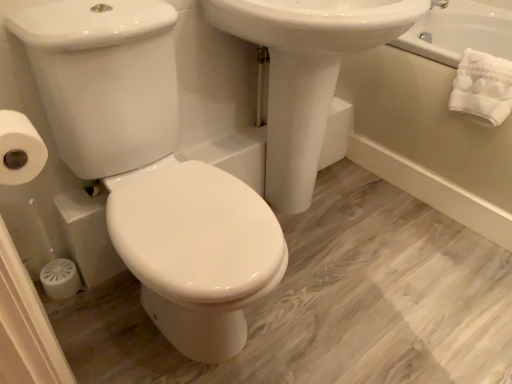
Question: Is the depth of white matte toilet paper at left less than that of white glossy porcelain at center?

Choices:
 (A) yes
 (B) no

Answer: (B)

Question: Would you say white glossy porcelain at center is part of white matte toilet paper at left's contents?

Choices:
 (A) no
 (B) yes

Answer: (A)

Question: Is white matte toilet paper at left turned away from white glossy porcelain at center?

Choices:
 (A) no
 (B) yes

Answer: (A)

Question: Can you confirm if white matte toilet paper at left is thinner than white glossy porcelain at center?

Choices:
 (A) yes
 (B) no

Answer: (A)

Question: From the image's perspective, is white matte toilet paper at left under white glossy porcelain at center?

Choices:
 (A) no
 (B) yes

Answer: (A)

Question: Can you confirm if white matte toilet paper at left is smaller than white glossy porcelain at center?

Choices:
 (A) yes
 (B) no

Answer: (A)

Question: Can you confirm if white glossy porcelain at center is shorter than white soft towel at upper right?

Choices:
 (A) no
 (B) yes

Answer: (A)

Question: Is white glossy porcelain at center beside white soft towel at upper right?

Choices:
 (A) no
 (B) yes

Answer: (A)

Question: Would you say white glossy porcelain at center is outside white soft towel at upper right?

Choices:
 (A) yes
 (B) no

Answer: (A)

Question: Is white glossy porcelain at center looking in the opposite direction of white soft towel at upper right?

Choices:
 (A) no
 (B) yes

Answer: (A)

Question: Can white soft towel at upper right be found inside white glossy porcelain at center?

Choices:
 (A) yes
 (B) no

Answer: (B)

Question: From the image's perspective, is white glossy porcelain at center on top of white soft towel at upper right?

Choices:
 (A) yes
 (B) no

Answer: (B)

Question: Considering the relative sizes of white soft towel at upper right and white glossy porcelain at center in the image provided, is white soft towel at upper right smaller than white glossy porcelain at center?

Choices:
 (A) no
 (B) yes

Answer: (B)